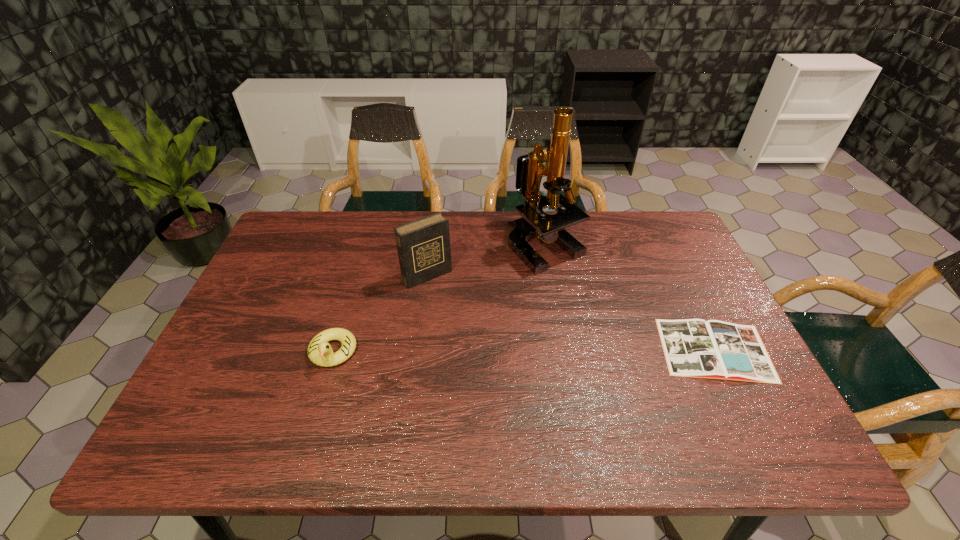
This screenshot has height=540, width=960. Find the location of `blank space located 0.250m on the front cover of the second tallest object`. blank space located 0.250m on the front cover of the second tallest object is located at coordinates (486, 346).

Locate an element on the screen. vacant area situated 0.080m on the front cover of the second tallest object is located at coordinates (453, 304).

At what (x,y) coordinates should I click in order to perform the action: click on free space located 0.210m at the eyepiece of the second object from right to left. Please return your answer as a coordinate pair (x, y). Image resolution: width=960 pixels, height=540 pixels. Looking at the image, I should click on point(572,330).

Identify the location of vacant space located 0.170m at the eyepiece of the second object from right to left. (568, 318).

The image size is (960, 540). Find the location of `vacant space located 0.080m at the eyepiece of the second object from right to left`. vacant space located 0.080m at the eyepiece of the second object from right to left is located at coordinates (561, 294).

In order to click on object that is positioned at the far edge in this screenshot , I will do `click(534, 223)`.

Image resolution: width=960 pixels, height=540 pixels. Identify the location of object present at the near edge. (714, 349).

Identify the location of object present at the right edge. (714, 349).

At what (x,y) coordinates should I click in order to perform the action: click on object at the near right corner. Please return your answer as a coordinate pair (x, y). Looking at the image, I should click on (714, 349).

Find the location of a particular element. The height and width of the screenshot is (540, 960). free space at the far edge is located at coordinates coord(396,214).